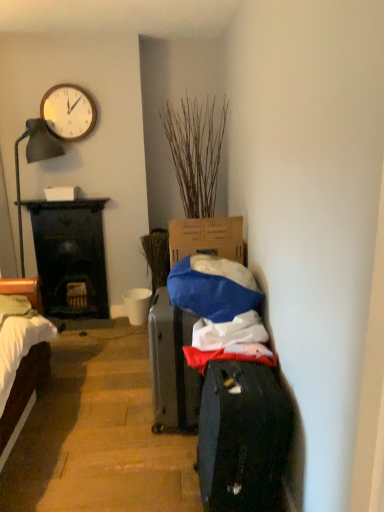
Question: Should I look upward or downward to see wooden clock at upper left?

Choices:
 (A) up
 (B) down

Answer: (A)

Question: Can you confirm if white matte bucket at center is positioned to the left of dark wood desk at left?

Choices:
 (A) yes
 (B) no

Answer: (B)

Question: Could you tell me if white matte bucket at center is facing dark wood desk at left?

Choices:
 (A) no
 (B) yes

Answer: (A)

Question: Can you confirm if white matte bucket at center is wider than dark wood desk at left?

Choices:
 (A) no
 (B) yes

Answer: (B)

Question: Does white matte bucket at center contain dark wood desk at left?

Choices:
 (A) no
 (B) yes

Answer: (A)

Question: Is white matte bucket at center further to camera compared to dark wood desk at left?

Choices:
 (A) yes
 (B) no

Answer: (A)

Question: Considering the relative positions of white matte bucket at center and dark wood desk at left in the image provided, is white matte bucket at center to the right of dark wood desk at left from the viewer's perspective?

Choices:
 (A) no
 (B) yes

Answer: (B)

Question: From a real-world perspective, does dry grass at center stand above dark gray fabric suitcase at center?

Choices:
 (A) yes
 (B) no

Answer: (A)

Question: Is dry grass at center smaller than dark gray fabric suitcase at center?

Choices:
 (A) yes
 (B) no

Answer: (B)

Question: Considering the relative positions of dry grass at center and dark gray fabric suitcase at center in the image provided, is dry grass at center in front of dark gray fabric suitcase at center?

Choices:
 (A) no
 (B) yes

Answer: (A)

Question: Is dry grass at center to the right of dark gray fabric suitcase at center from the viewer's perspective?

Choices:
 (A) yes
 (B) no

Answer: (B)

Question: Is dry grass at center thinner than dark gray fabric suitcase at center?

Choices:
 (A) no
 (B) yes

Answer: (A)

Question: Does dry grass at center turn towards dark gray fabric suitcase at center?

Choices:
 (A) yes
 (B) no

Answer: (A)

Question: Considering the relative positions of wooden clock at upper left and dry grass at center in the image provided, is wooden clock at upper left in front of dry grass at center?

Choices:
 (A) yes
 (B) no

Answer: (B)